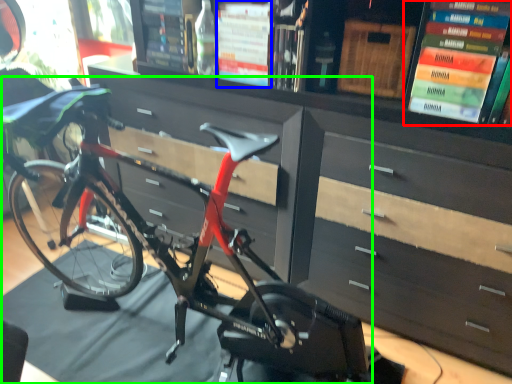
Question: Which is farther away from book (highlighted by a red box)? book (highlighted by a blue box) or bicycle (highlighted by a green box)?

Choices:
 (A) book
 (B) bicycle

Answer: (B)